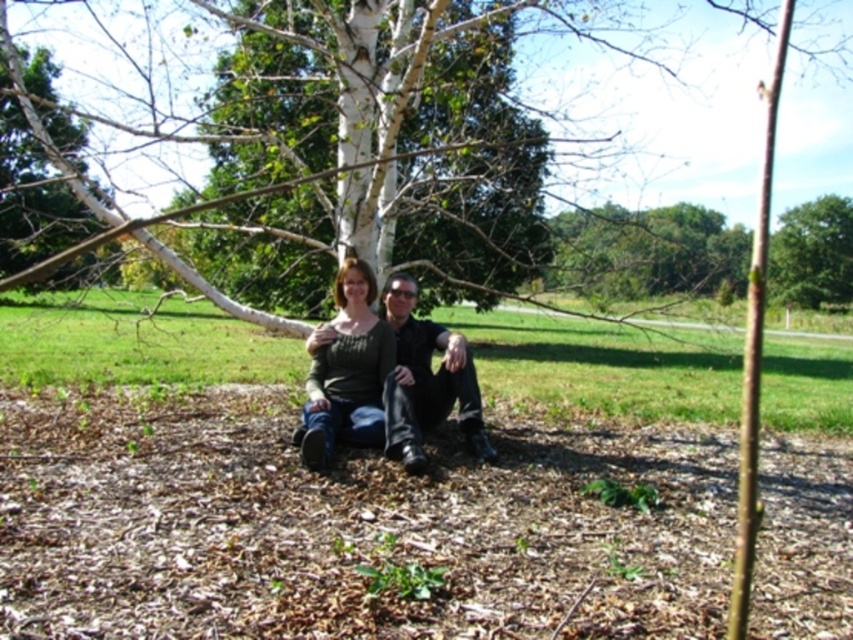
You are standing at the origin point in the image and want to move towards the two points labeled as point [376,362] and point [445,360]. Which point is closer to you?

Point [445,360] is closer to you because it is in front of point [376,362], which is behind it according to the spatial description.

You are an observer standing at the center of the image. You see a point labeled at coordinates point (x=347, y=371). What object is located at that point?

The point (x=347, y=371) indicates the location of the matte green sweater at center.